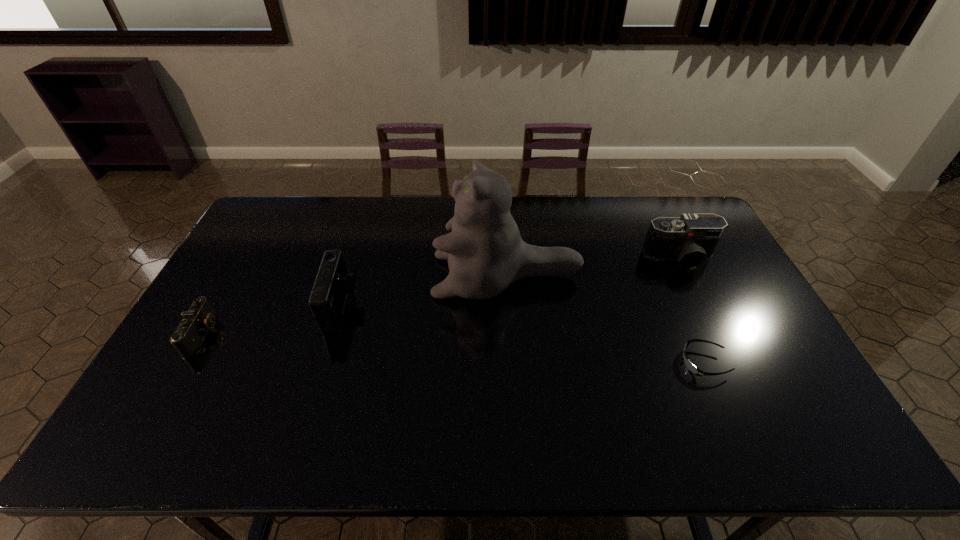
Identify the location of the tallest object. Image resolution: width=960 pixels, height=540 pixels. (485, 252).

This screenshot has width=960, height=540. In order to click on the third object from left to right in this screenshot , I will do `click(485, 252)`.

The height and width of the screenshot is (540, 960). Identify the location of the fourth object from right to left. (333, 283).

Where is `the farthest camera`? The height and width of the screenshot is (540, 960). the farthest camera is located at coordinates (691, 239).

Find the location of `the leftmost object`. the leftmost object is located at coordinates click(x=200, y=317).

Where is `the leftmost camera`? the leftmost camera is located at coordinates (200, 317).

This screenshot has width=960, height=540. Identify the location of the shortest object. (689, 365).

What are the coordinates of `vacant space situated 0.060m on the face of the cat` in the screenshot? It's located at (414, 276).

Where is `free space located 0.370m on the face of the cat`? The height and width of the screenshot is (540, 960). free space located 0.370m on the face of the cat is located at coordinates (317, 276).

Identify the location of vacant space located on the face of the cat. (389, 276).